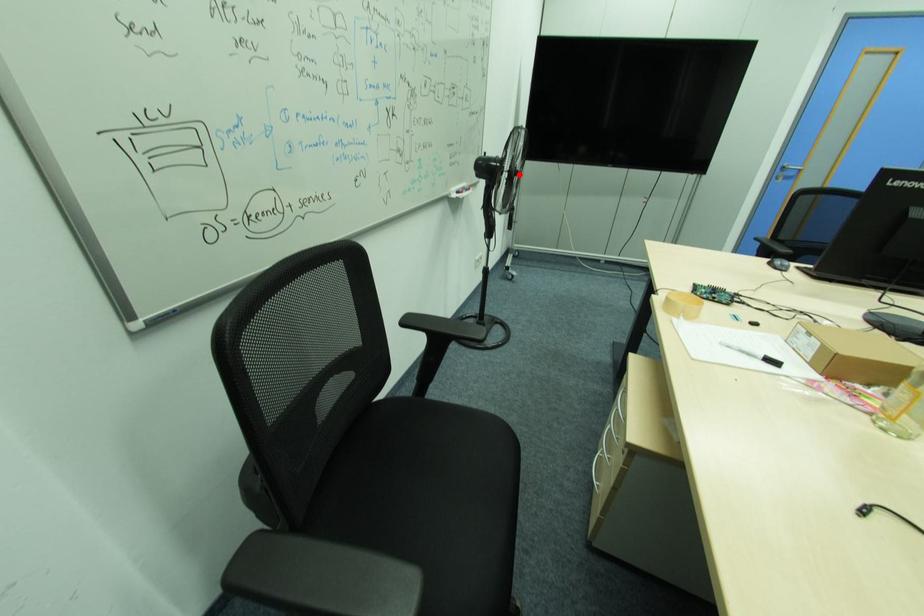
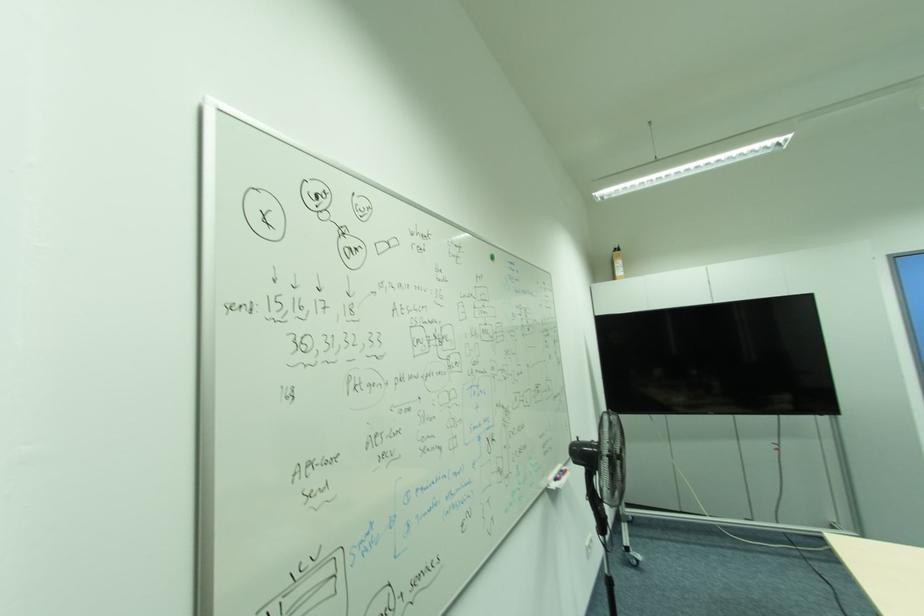
Find the pixel in the second image that matches the highlighted location in the first image.

(621, 459)